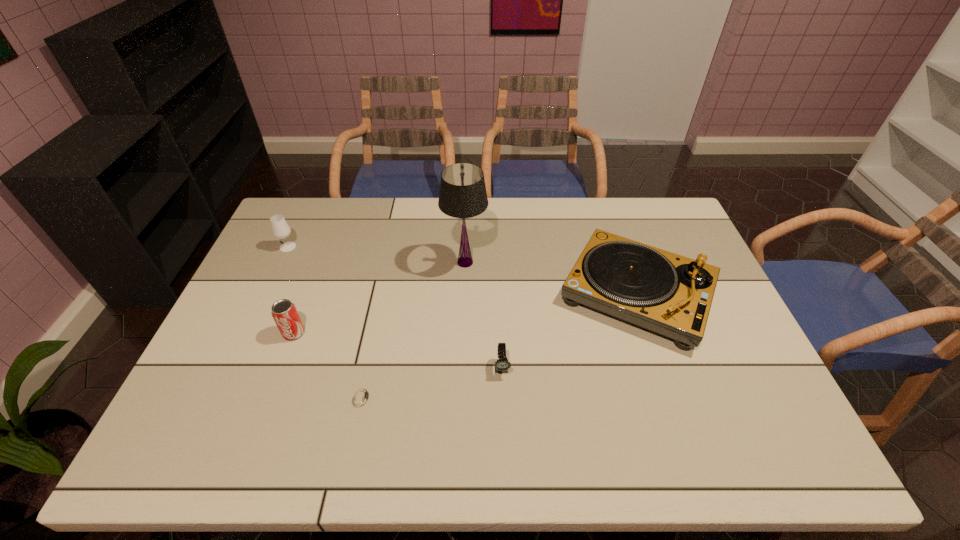
Where is `free space at the right edge of the desktop`? The image size is (960, 540). free space at the right edge of the desktop is located at coordinates (774, 415).

The height and width of the screenshot is (540, 960). Find the location of `vacant region at the far right corner of the desktop`. vacant region at the far right corner of the desktop is located at coordinates (661, 201).

Where is `blank region between the shortest object and the soda can`? The height and width of the screenshot is (540, 960). blank region between the shortest object and the soda can is located at coordinates (327, 365).

At what (x,y) coordinates should I click in order to perform the action: click on free spot between the taller watch and the lampshade. Please return your answer as a coordinate pair (x, y). The width and height of the screenshot is (960, 540). Looking at the image, I should click on (484, 315).

Image resolution: width=960 pixels, height=540 pixels. Identify the location of free spot between the right watch and the rightmost object. (569, 331).

You are a GUI agent. You are given a task and a screenshot of the screen. Output one action in this format:
    pyautogui.click(x=<x>, y=<y>)
    Task: Click on the vacant space that is in between the nearest object and the leftmost object
    Image resolution: width=960 pixels, height=540 pixels.
    Given the screenshot: What is the action you would take?
    pyautogui.click(x=324, y=322)

You are a GUI agent. You are given a task and a screenshot of the screen. Output one action in this format:
    pyautogui.click(x=<x>, y=<y>)
    Task: Click on the free space that is in between the tallest object and the shortest object
    
    Given the screenshot: What is the action you would take?
    pyautogui.click(x=414, y=330)

This screenshot has height=540, width=960. Identify the location of empty space that is in between the fifth object from right to left and the third object from left to right. (327, 365).

I want to click on free spot between the farther watch and the nearest object, so click(x=432, y=382).

Locate an element on the screen. The height and width of the screenshot is (540, 960). vacant region between the farther watch and the record player is located at coordinates (569, 331).